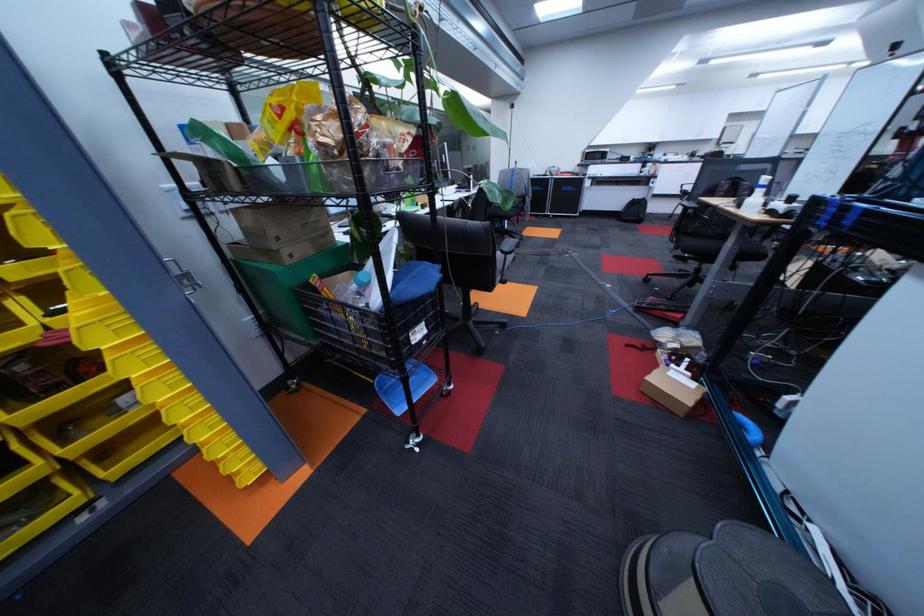
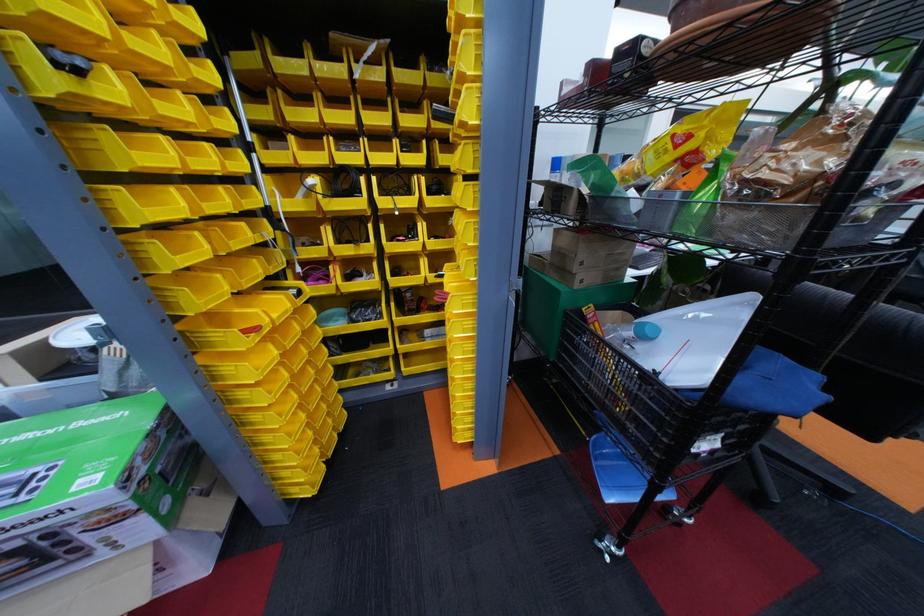
Find the pixel in the second image that matches pixel 305 257 in the first image.

(594, 282)